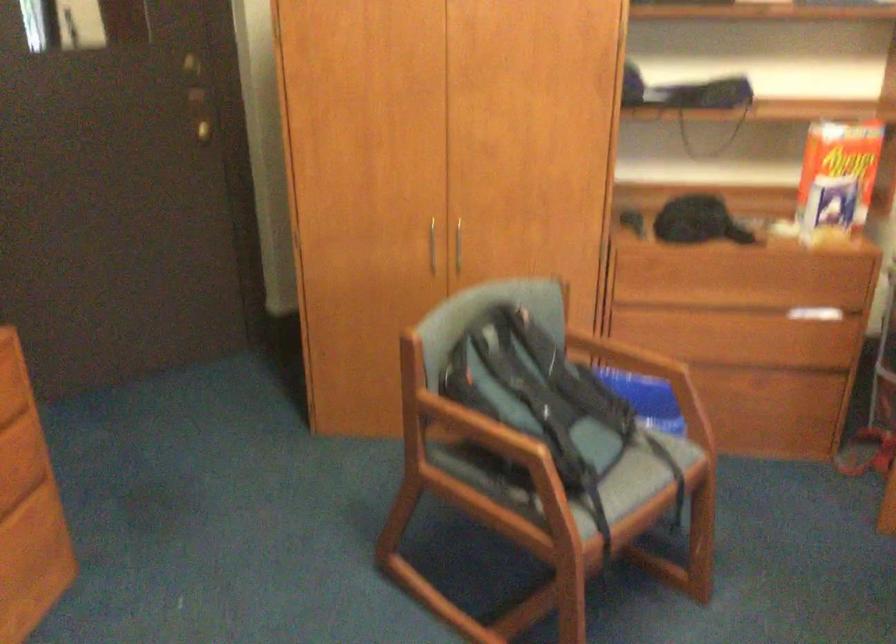
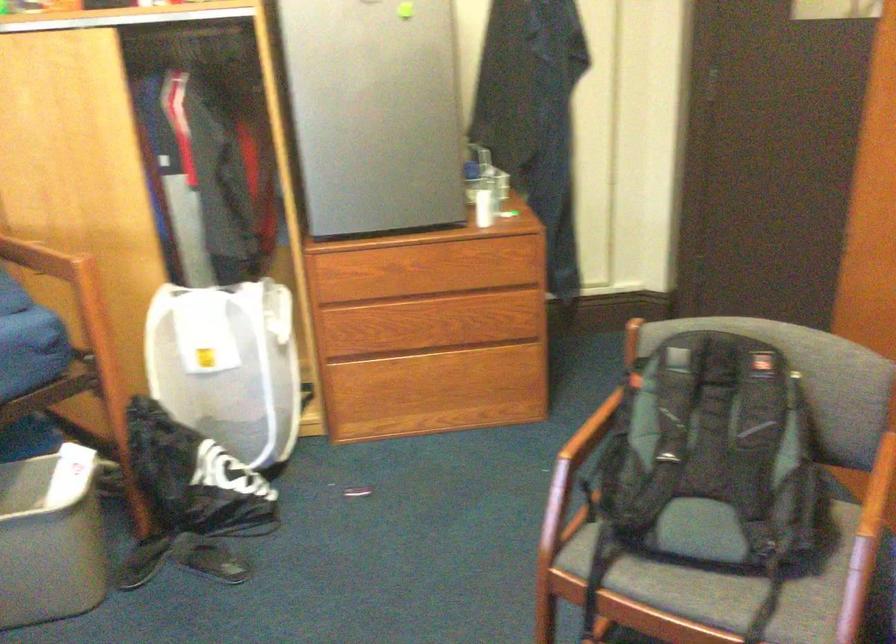
In the second image, find the point that corresponds to [478,438] in the first image.

(588, 436)